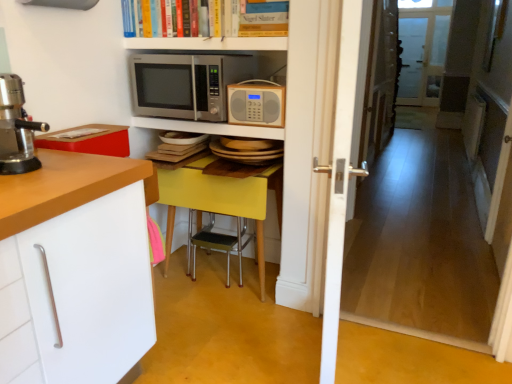
At what (x,y) coordinates should I click in order to perform the action: click on free area below wooden floor at center (from a real-world perspective). Please return your answer as a coordinate pair (x, y). The image size is (512, 384). Looking at the image, I should click on (377, 320).